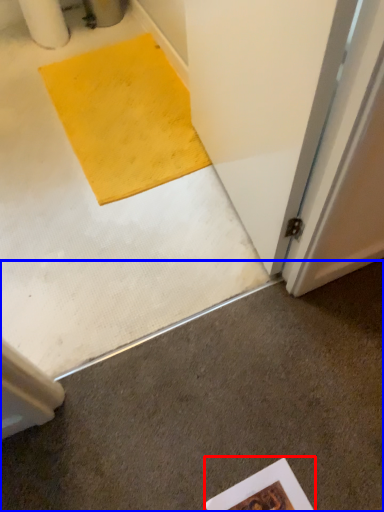
Question: Which object is further to the camera taking this photo, writing (highlighted by a red box) or concrete (highlighted by a blue box)?

Choices:
 (A) writing
 (B) concrete

Answer: (A)